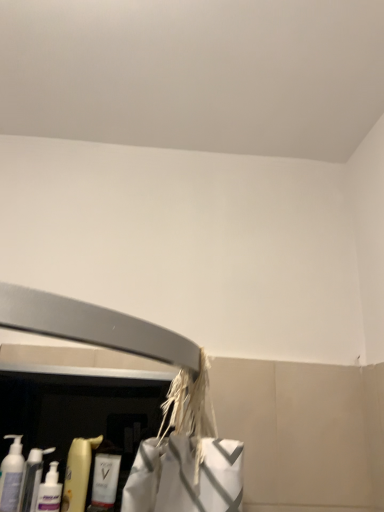
Question: Is the surface of translucent plastic pump bottle at lower left, arranged as the first cleaning product when viewed from the left, in direct contact with white glossy bottle at lower left, which is the 1th cleaning product from right to left?

Choices:
 (A) yes
 (B) no

Answer: (B)

Question: Does translucent plastic pump bottle at lower left, the fourth cleaning product when ordered from right to left, have a greater width compared to white glossy bottle at lower left, the 4th cleaning product viewed from the left?

Choices:
 (A) no
 (B) yes

Answer: (B)

Question: Is translucent plastic pump bottle at lower left, the fourth cleaning product when ordered from right to left, bigger than white glossy bottle at lower left, which is the 1th cleaning product from right to left?

Choices:
 (A) yes
 (B) no

Answer: (A)

Question: Does translucent plastic pump bottle at lower left, arranged as the first cleaning product when viewed from the left, lie behind white glossy bottle at lower left, the 4th cleaning product viewed from the left?

Choices:
 (A) yes
 (B) no

Answer: (B)

Question: Is translucent plastic pump bottle at lower left, arranged as the first cleaning product when viewed from the left, located outside white glossy bottle at lower left, which is the 1th cleaning product from right to left?

Choices:
 (A) no
 (B) yes

Answer: (B)

Question: Can you confirm if translucent plastic pump bottle at lower left, arranged as the first cleaning product when viewed from the left, is shorter than white glossy bottle at lower left, which is the 1th cleaning product from right to left?

Choices:
 (A) yes
 (B) no

Answer: (B)

Question: From the image's perspective, does white glossy bottle at lower left, which is the 1th cleaning product from right to left, appear lower than translucent plastic bottle at lower left, the 2th cleaning product from the right?

Choices:
 (A) yes
 (B) no

Answer: (A)

Question: Can you confirm if white glossy bottle at lower left, the 4th cleaning product viewed from the left, is shorter than translucent plastic bottle at lower left, the 2th cleaning product from the right?

Choices:
 (A) yes
 (B) no

Answer: (A)

Question: Does white glossy bottle at lower left, which is the 1th cleaning product from right to left, come behind translucent plastic bottle at lower left, the 2th cleaning product from the right?

Choices:
 (A) no
 (B) yes

Answer: (B)

Question: Considering the relative sizes of white glossy bottle at lower left, the 4th cleaning product viewed from the left, and translucent plastic bottle at lower left, the 2th cleaning product from the right, in the image provided, is white glossy bottle at lower left, the 4th cleaning product viewed from the left, bigger than translucent plastic bottle at lower left, the 2th cleaning product from the right,?

Choices:
 (A) yes
 (B) no

Answer: (B)

Question: Is white glossy bottle at lower left, which is the 1th cleaning product from right to left, positioned with its back to translucent plastic bottle at lower left, which is counted as the 3th cleaning product, starting from the left?

Choices:
 (A) no
 (B) yes

Answer: (A)

Question: From the image's perspective, is white glossy bottle at lower left, the 4th cleaning product viewed from the left, above translucent plastic bottle at lower left, the 2th cleaning product from the right?

Choices:
 (A) no
 (B) yes

Answer: (A)

Question: Considering the relative positions of translucent plastic bottles at lower left, acting as the third cleaning product starting from the right, and white glossy bottle at lower left, which is the 1th cleaning product from right to left, in the image provided, is translucent plastic bottles at lower left, acting as the third cleaning product starting from the right, to the left of white glossy bottle at lower left, which is the 1th cleaning product from right to left, from the viewer's perspective?

Choices:
 (A) no
 (B) yes

Answer: (B)